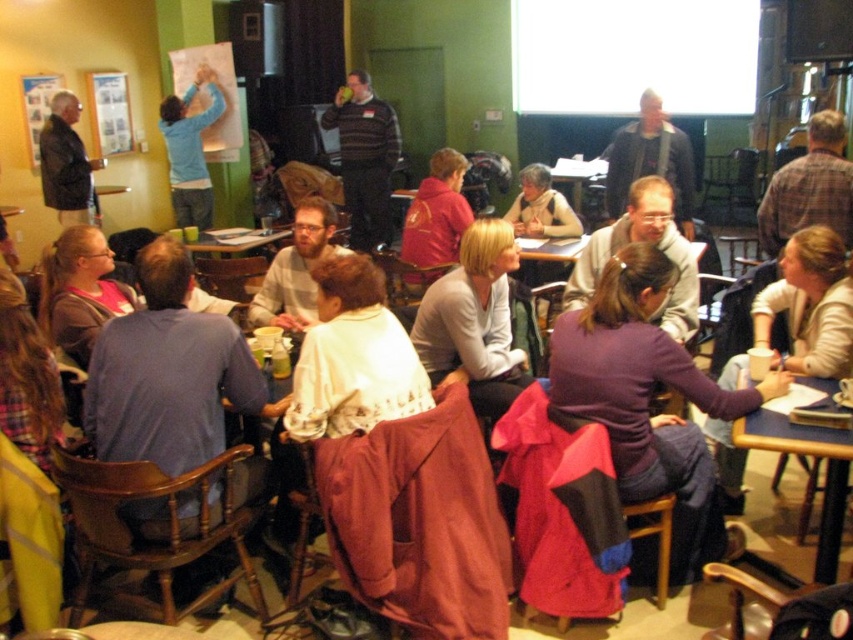
Between plaid shirt at center and matte black jacket at left, which one appears on the left side from the viewer's perspective?

From the viewer's perspective, matte black jacket at left appears more on the left side.

Which is more to the right, plaid shirt at center or matte black jacket at left?

Positioned to the right is plaid shirt at center.

Find the location of `plaid shirt at center`. plaid shirt at center is located at coordinates (809, 188).

Where is `plaid shirt at center`? The width and height of the screenshot is (853, 640). plaid shirt at center is located at coordinates (809, 188).

Is point (833, 179) farther from viewer compared to point (173, 120)?

No, (833, 179) is closer to viewer.

Measure the distance between point (822, 152) and camera.

Point (822, 152) is 12.83 feet from camera.

Identify the location of plaid shirt at center. (809, 188).

Between striped sweater at center and matte plastic table at center, which one is positioned lower?

matte plastic table at center

Can you confirm if striped sweater at center is positioned above matte plastic table at center?

Indeed, striped sweater at center is positioned over matte plastic table at center.

Is point (387, 189) in front of point (201, 236)?

No, (387, 189) is further to viewer.

I want to click on striped sweater at center, so click(x=364, y=157).